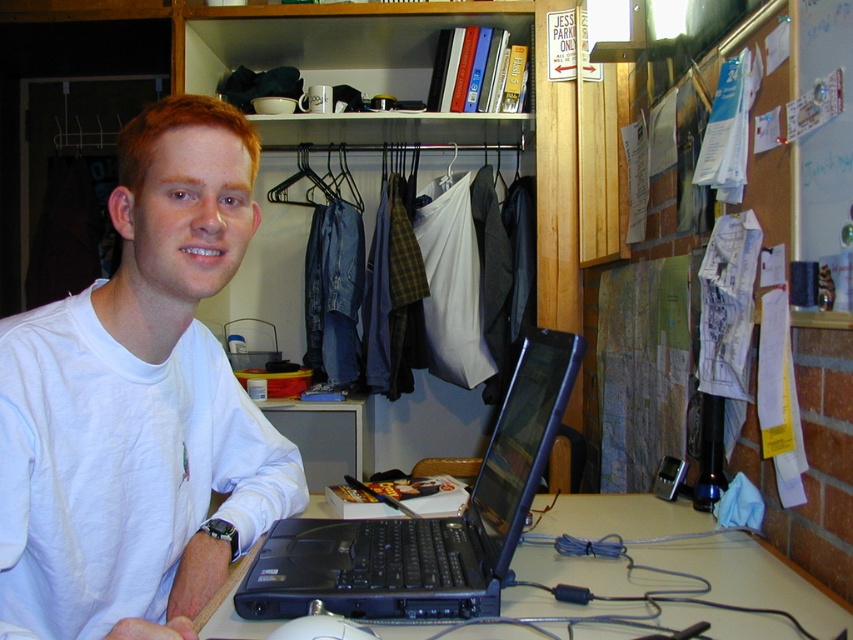
You are a photographer taking a picture of the scene. The white cotton shirt at center and the black plastic laptop at lower center are both in the frame. Which object appears taller in the photo?

The white cotton shirt at center appears taller in the photo because it has a greater height compared to the black plastic laptop at lower center.

You need to place both the black plastic laptop at lower center and the white matte mouse at lower center into a rectangular box. The box can only accommodate items that are narrower than 30 centimeters. Based on their widths, can both items fit into the box?

The black plastic laptop at lower center might be wider than white matte mouse at lower center. Since the laptop might exceed 30 centimeters in width, it may not fit into the box. The mouse is likely narrower, so it could fit. However, without exact measurements, we can only assume the laptop might not fit while the mouse probably does.

The scene shows a young man at a desk with several items. There is a point marked at coordinates (602, 534). What object is located at this point?

The point at coordinates (602, 534) indicates the black plastic laptop at lower center.